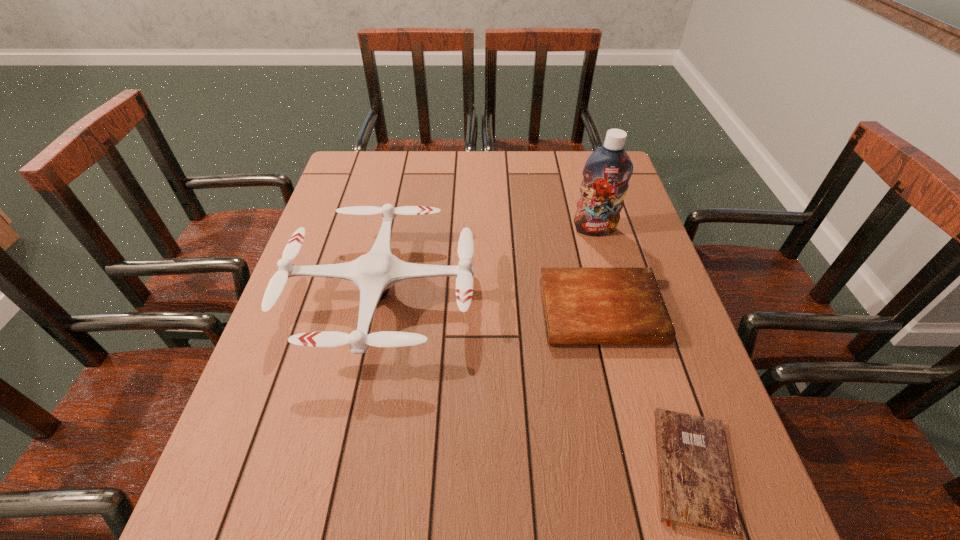
Where is `the tallest object`? This screenshot has width=960, height=540. the tallest object is located at coordinates (607, 171).

You are a GUI agent. You are given a task and a screenshot of the screen. Output one action in this format:
    pyautogui.click(x=<x>, y=<y>)
    Task: Click on the drone
    The width and height of the screenshot is (960, 540).
    Given the screenshot: What is the action you would take?
    pyautogui.click(x=374, y=273)

Find the location of a particular element. This screenshot has height=540, width=960. the leftmost object is located at coordinates (374, 273).

Where is `the taller Bible`? the taller Bible is located at coordinates (581, 305).

Find the location of a particular element. the farther Bible is located at coordinates (581, 305).

Locate an element on the screen. the nearest object is located at coordinates (696, 490).

Identify the location of the shorter Bible. Image resolution: width=960 pixels, height=540 pixels. (696, 490).

Identify the location of free space located 0.290m on the front label of the shampoo. (620, 320).

At what (x,y) coordinates should I click in order to perform the action: click on blank area located with the camera attached at the bottom of the second tallest object. Please return your answer as a coordinate pair (x, y). Image resolution: width=960 pixels, height=540 pixels. Looking at the image, I should click on [x=336, y=521].

At what (x,y) coordinates should I click in order to perform the action: click on free space located on the spine side of the second shortest object. Please return your answer as a coordinate pair (x, y). Image resolution: width=960 pixels, height=540 pixels. Looking at the image, I should click on (653, 526).